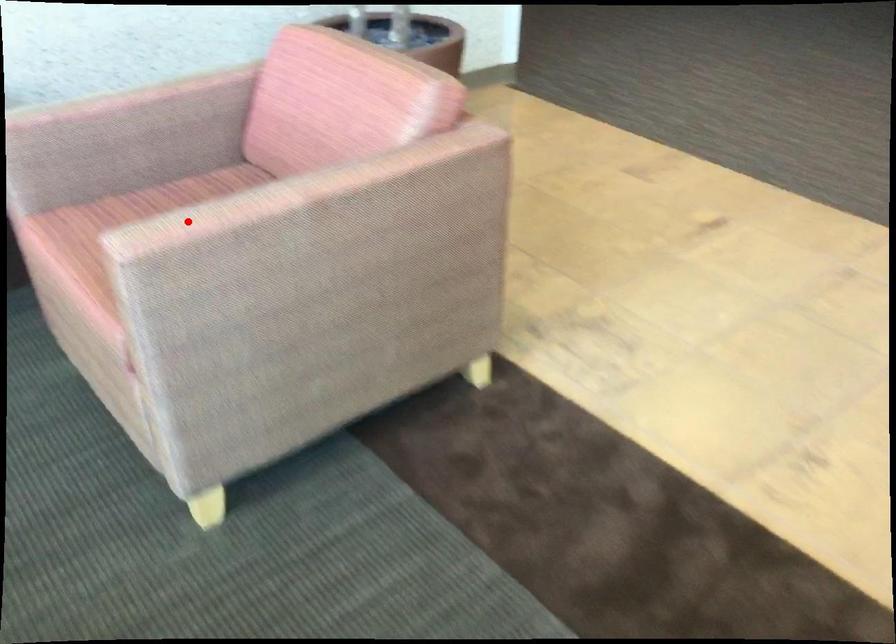
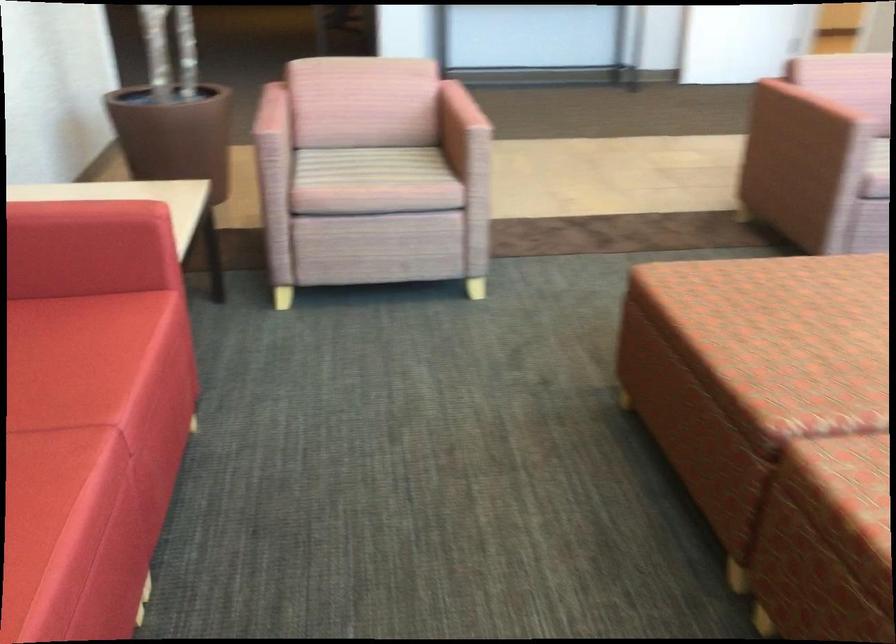
Find the pixel in the second image that matches the highlighted location in the first image.

(459, 118)